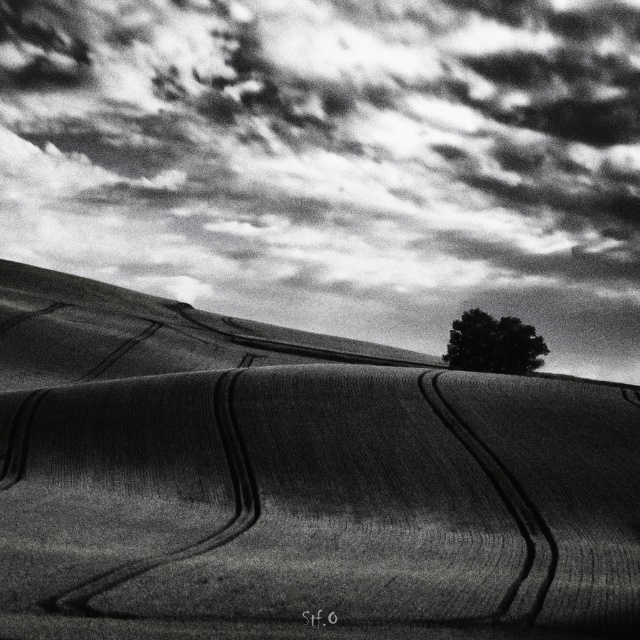
Question: Which point is farther to the camera?

Choices:
 (A) smooth soil at center
 (B) cloudy sky at upper center

Answer: (B)

Question: Does cloudy sky at upper center have a larger size compared to dark green textured tree at center?

Choices:
 (A) yes
 (B) no

Answer: (A)

Question: Can you confirm if smooth soil at center is positioned to the left of dark green textured tree at center?

Choices:
 (A) yes
 (B) no

Answer: (A)

Question: Estimate the real-world distances between objects in this image. Which object is farther from the dark green textured tree at center?

Choices:
 (A) cloudy sky at upper center
 (B) smooth soil at center

Answer: (A)

Question: Can you confirm if smooth soil at center is positioned to the right of dark green textured tree at center?

Choices:
 (A) yes
 (B) no

Answer: (B)

Question: Which object appears closest to the camera in this image?

Choices:
 (A) dark green textured tree at center
 (B) smooth soil at center

Answer: (B)